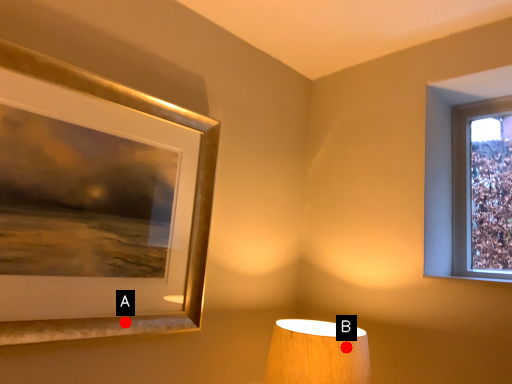
Question: Two points are circled on the image, labeled by A and B beside each circle. Which point appears farthest from the camera in this image?

Choices:
 (A) A is further
 (B) B is further

Answer: (B)